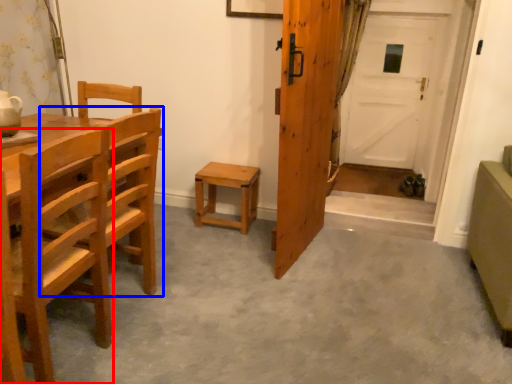
Question: Which point is closer to the camera, chair (highlighted by a red box) or chair (highlighted by a blue box)?

Choices:
 (A) chair
 (B) chair

Answer: (A)